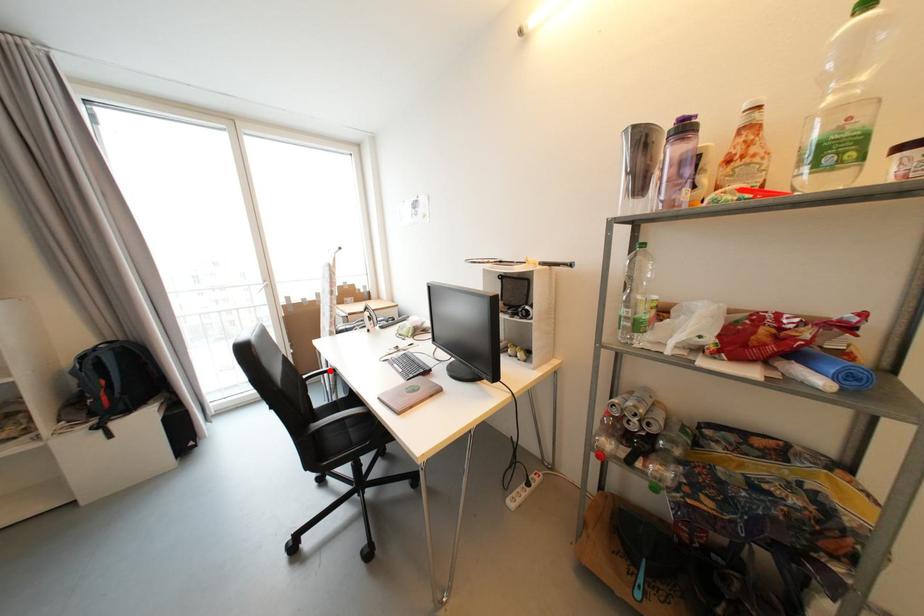
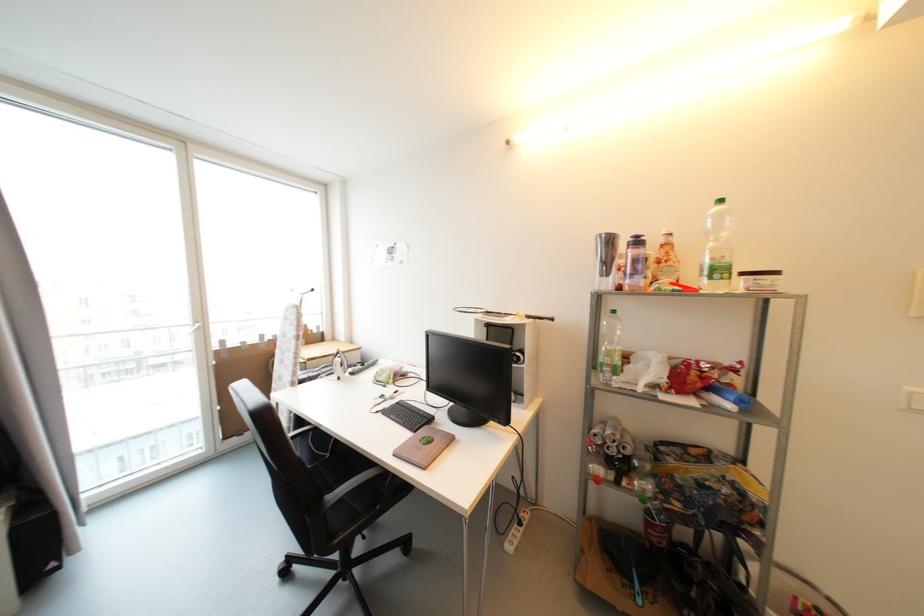
Locate, in the second image, the point that corresponds to the highlighted location in the first image.

(295, 429)